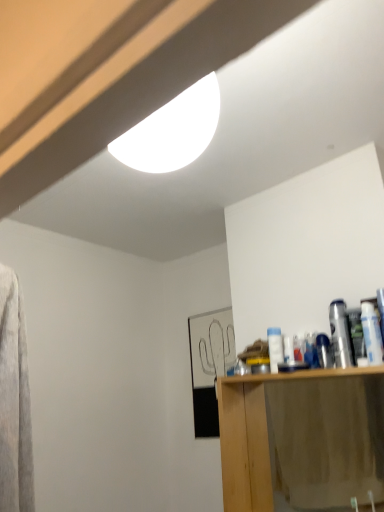
The image size is (384, 512). Describe the element at coordinates (302, 438) in the screenshot. I see `wooden cabinet at lower right` at that location.

In order to face wooden cabinet at lower right, should I rotate leftwards or rightwards?

Rotate your view right by about 15.272°.

Find the location of a particular element. This screenshot has width=384, height=512. wooden cabinet at lower right is located at coordinates 302,438.

What are the coordinates of `wooden cabinet at lower right` in the screenshot? It's located at (302, 438).